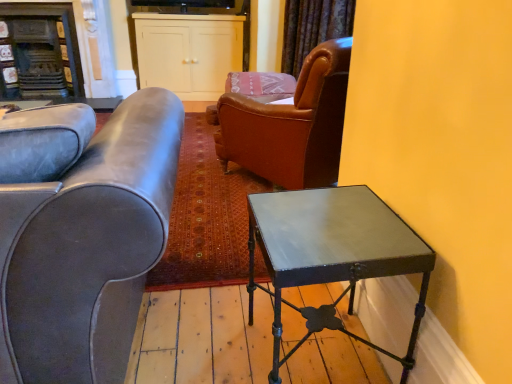
In order to click on leather couch at left in this screenshot , I will do `click(88, 248)`.

The height and width of the screenshot is (384, 512). Find the location of `white matte cabinet at upper center`. white matte cabinet at upper center is located at coordinates (188, 52).

What is the approximate width of white matte cabinet at upper center?

white matte cabinet at upper center is 18.27 inches wide.

Where is `dark brown wood fireplace at upper left`? This screenshot has width=512, height=384. dark brown wood fireplace at upper left is located at coordinates (39, 52).

The width and height of the screenshot is (512, 384). Describe the element at coordinates (313, 28) in the screenshot. I see `velvet dark brown curtain at upper center` at that location.

This screenshot has width=512, height=384. What do you see at coordinates (332, 254) in the screenshot?
I see `metallic dark green table at right` at bounding box center [332, 254].

Identify the location of leather couch at left. click(88, 248).

Based on the photo, is white matte cabinet at upper center oriented away from leather couch at left?

No, white matte cabinet at upper center's orientation is not away from leather couch at left.

Can you confirm if white matte cabinet at upper center is smaller than leather couch at left?

Correct, white matte cabinet at upper center occupies less space than leather couch at left.

Is white matte cabinet at upper center not close to leather couch at left?

white matte cabinet at upper center is far away from leather couch at left.

Between white matte cabinet at upper center and leather couch at left, which one is positioned in front?

leather couch at left.

From a real-world perspective, who is located lower, velvet dark brown curtain at upper center or dark brown wood fireplace at upper left?

dark brown wood fireplace at upper left.

Is velvet dark brown curtain at upper center positioned with its back to dark brown wood fireplace at upper left?

No, dark brown wood fireplace at upper left is not at the back of velvet dark brown curtain at upper center.

Considering the relative positions of velvet dark brown curtain at upper center and dark brown wood fireplace at upper left in the image provided, is velvet dark brown curtain at upper center to the right of dark brown wood fireplace at upper left from the viewer's perspective?

Indeed, velvet dark brown curtain at upper center is positioned on the right side of dark brown wood fireplace at upper left.

Does velvet dark brown curtain at upper center have a smaller size compared to dark brown wood fireplace at upper left?

Indeed, velvet dark brown curtain at upper center has a smaller size compared to dark brown wood fireplace at upper left.

Is leather couch at left directly adjacent to metallic dark green table at right?

leather couch at left is not next to metallic dark green table at right, and they're not touching.

Does point (10, 361) lie in front of point (362, 204)?

Yes, it is in front of point (362, 204).

Is leather couch at left oriented towards metallic dark green table at right?

No, leather couch at left is not aimed at metallic dark green table at right.

Find the location of `cabinetry that is behind the velvet dark brown curtain at upper center`. cabinetry that is behind the velvet dark brown curtain at upper center is located at coordinates (188, 52).

Is velvet dark brown curtain at upper center bigger or smaller than white matte cabinet at upper center?

Clearly, velvet dark brown curtain at upper center is smaller in size than white matte cabinet at upper center.

Is velvet dark brown curtain at upper center inside the boundaries of white matte cabinet at upper center, or outside?

velvet dark brown curtain at upper center lies outside white matte cabinet at upper center.

From a real-world perspective, relative to white matte cabinet at upper center, is velvet dark brown curtain at upper center vertically above or below?

Clearly, from a real-world perspective, velvet dark brown curtain at upper center is above white matte cabinet at upper center.

You are a GUI agent. You are given a task and a screenshot of the screen. Output one action in this format:
    pyautogui.click(x=<x>, y=<y>)
    Task: Click on the fireplace above the velvet dark brown curtain at upper center (from the image's perspective)
    The width and height of the screenshot is (512, 384).
    Given the screenshot: What is the action you would take?
    pyautogui.click(x=39, y=52)

Considering the relative sizes of dark brown wood fireplace at upper left and velvet dark brown curtain at upper center in the image provided, is dark brown wood fireplace at upper left wider than velvet dark brown curtain at upper center?

Correct, the width of dark brown wood fireplace at upper left exceeds that of velvet dark brown curtain at upper center.

Which point is more distant from viewer, (15, 63) or (323, 19)?

Positioned behind is point (15, 63).

From the image's perspective, is dark brown wood fireplace at upper left on top of velvet dark brown curtain at upper center?

Yes, from the image's perspective, dark brown wood fireplace at upper left is on top of velvet dark brown curtain at upper center.

I want to click on fireplace on the left of metallic dark green table at right, so click(39, 52).

Is metallic dark green table at right positioned behind dark brown wood fireplace at upper left?

No, it is not.

Consider the image. Is dark brown wood fireplace at upper left completely or partially inside metallic dark green table at right?

No.

From a real-world perspective, which object rests below the other?

From a 3D spatial view, metallic dark green table at right is below.

Where is `curtain located below the white matte cabinet at upper center (from the image's perspective)`? Image resolution: width=512 pixels, height=384 pixels. curtain located below the white matte cabinet at upper center (from the image's perspective) is located at coordinates (313, 28).

Is white matte cabinet at upper center taller or shorter than velvet dark brown curtain at upper center?

In the image, white matte cabinet at upper center appears to be taller than velvet dark brown curtain at upper center.

Considering their positions, is white matte cabinet at upper center located in front of or behind velvet dark brown curtain at upper center?

white matte cabinet at upper center is behind velvet dark brown curtain at upper center.

From the picture: Would you say white matte cabinet at upper center is a long distance from velvet dark brown curtain at upper center?

That's right, there is a large distance between white matte cabinet at upper center and velvet dark brown curtain at upper center.

The image size is (512, 384). What are the coordinates of `studio couch that appears on the right of white matte cabinet at upper center` in the screenshot? It's located at (88, 248).

Locate an element on the screen. The width and height of the screenshot is (512, 384). curtain below the dark brown wood fireplace at upper left (from the image's perspective) is located at coordinates (313, 28).

Considering their positions, is white matte cabinet at upper center positioned further to leather couch at left than velvet dark brown curtain at upper center?

white matte cabinet at upper center lies further to leather couch at left than the other object.

Considering their positions, is dark brown wood fireplace at upper left positioned further to leather couch at left than velvet dark brown curtain at upper center?

dark brown wood fireplace at upper left lies further to leather couch at left than the other object.

Based on their spatial positions, is metallic dark green table at right or leather couch at left further from dark brown wood fireplace at upper left?

Based on the image, metallic dark green table at right appears to be further to dark brown wood fireplace at upper left.

Considering their positions, is leather couch at left positioned closer to metallic dark green table at right than velvet dark brown curtain at upper center?

leather couch at left is positioned closer to the anchor metallic dark green table at right.

Looking at the image, which one is located closer to metallic dark green table at right, white matte cabinet at upper center or velvet dark brown curtain at upper center?

Based on the image, velvet dark brown curtain at upper center appears to be nearer to metallic dark green table at right.

Based on their spatial positions, is white matte cabinet at upper center or metallic dark green table at right closer to velvet dark brown curtain at upper center?

The object closer to velvet dark brown curtain at upper center is white matte cabinet at upper center.

Which object lies further to the anchor point leather couch at left, velvet dark brown curtain at upper center or dark brown wood fireplace at upper left?

Based on the image, dark brown wood fireplace at upper left appears to be further to leather couch at left.

Considering their positions, is leather couch at left positioned further to velvet dark brown curtain at upper center than white matte cabinet at upper center?

The object further to velvet dark brown curtain at upper center is leather couch at left.

This screenshot has height=384, width=512. Find the location of `cabinetry located between dark brown wood fireplace at upper left and velvet dark brown curtain at upper center in the left-right direction`. cabinetry located between dark brown wood fireplace at upper left and velvet dark brown curtain at upper center in the left-right direction is located at coordinates (188, 52).

Find the location of `table between leather couch at left and velvet dark brown curtain at upper center from front to back`. table between leather couch at left and velvet dark brown curtain at upper center from front to back is located at coordinates (332, 254).

Identify the location of curtain between leather couch at left and white matte cabinet at upper center from front to back. (313, 28).

Identify the location of table located between leather couch at left and white matte cabinet at upper center in the depth direction. This screenshot has height=384, width=512. (332, 254).